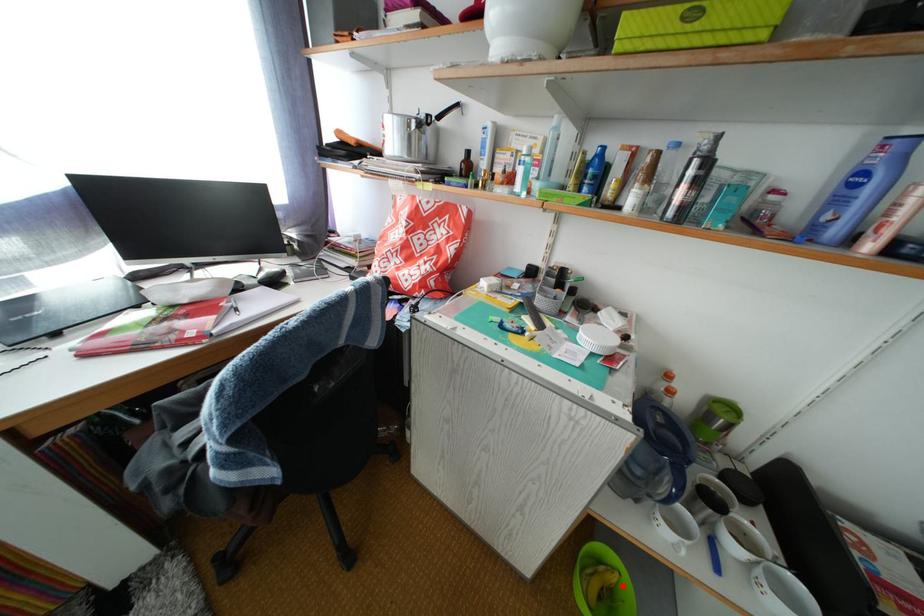
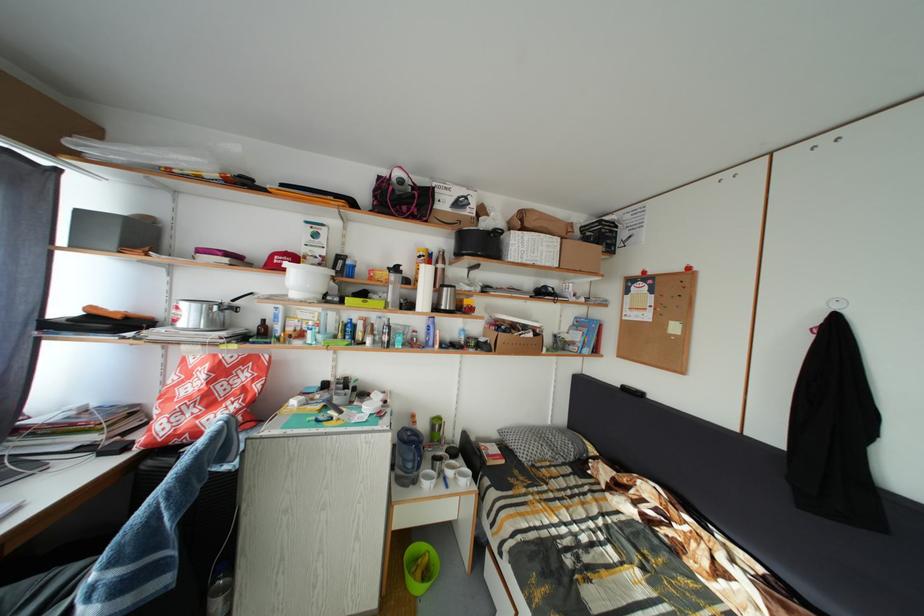
Question: I am providing you with two images of the same scene from different viewpoints. A red point is shown in image1. For the corresponding object point in image2, is it positioned nearer or farther from the camera?

Choices:
 (A) Nearer
 (B) Farther

Answer: (B)